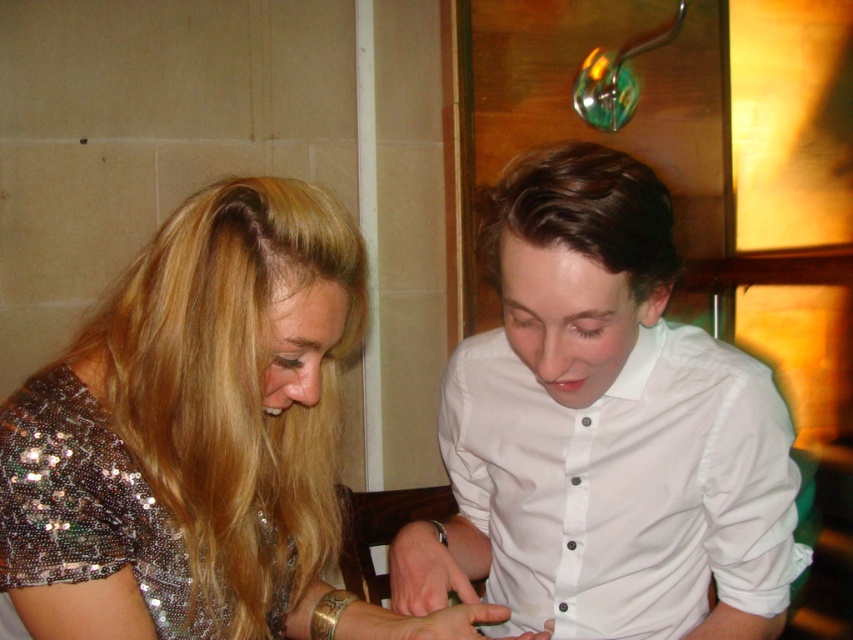
Question: Does shiny sequined dress at center appear on the right side of sparkly sequined dress at lower left?

Choices:
 (A) yes
 (B) no

Answer: (A)

Question: Among these objects, which one is farthest from the camera?

Choices:
 (A) sparkly sequined dress at lower left
 (B) shiny sequined dress at center
 (C) white button-down shirt at center

Answer: (C)

Question: Is white button-down shirt at center below sparkly sequined dress at lower left?

Choices:
 (A) yes
 (B) no

Answer: (B)

Question: Which is farther from the shiny sequined dress at center?

Choices:
 (A) sparkly sequined dress at lower left
 (B) white button-down shirt at center

Answer: (B)

Question: Which object is the closest to the sparkly sequined dress at lower left?

Choices:
 (A) white button-down shirt at center
 (B) shiny sequined dress at center

Answer: (B)

Question: Can you confirm if white button-down shirt at center is thinner than shiny sequined dress at center?

Choices:
 (A) no
 (B) yes

Answer: (A)